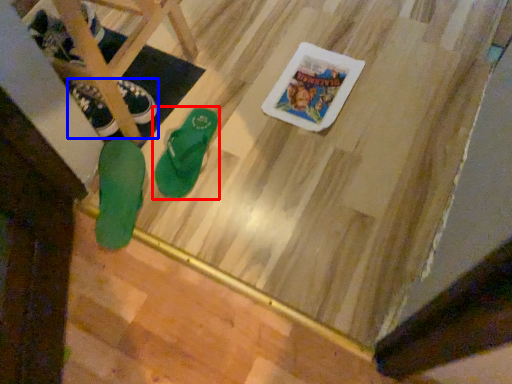
Question: Among these objects, which one is nearest to the camera, footwear (highlighted by a red box) or footwear (highlighted by a blue box)?

Choices:
 (A) footwear
 (B) footwear

Answer: (A)